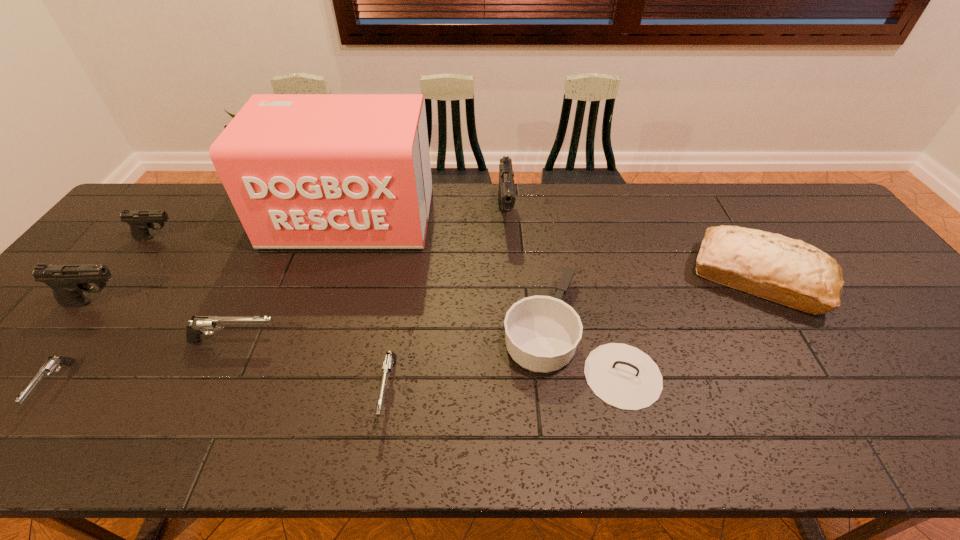
Locate an element on the screen. The width and height of the screenshot is (960, 540). vacant area that lies between the second silver pistol from right to left and the rightmost object is located at coordinates (497, 309).

This screenshot has height=540, width=960. In order to click on empty location between the rightmost object and the farthest silver pistol in this screenshot , I will do `click(497, 309)`.

Select which object is the third closest to the saucepan. Please provide its 2D coordinates. Your answer should be formatted as a tuple, i.e. [(x, y)], where the tuple contains the x and y coordinates of a point satisfying the conditions above.

[(303, 171)]

This screenshot has height=540, width=960. In order to click on object that is the seventh closest one to the saucepan in this screenshot , I will do `click(139, 221)`.

Find the location of `pistol that is the fifth closest one to the box`. pistol that is the fifth closest one to the box is located at coordinates (390, 359).

Find the location of `the fourth closest pistol to the saucepan`. the fourth closest pistol to the saucepan is located at coordinates (68, 282).

The image size is (960, 540). I want to click on the second closest black pistol relative to the shortest object, so click(139, 221).

Identify the location of black pistol that is the second closest to the rightmost silver pistol. The height and width of the screenshot is (540, 960). (68, 282).

This screenshot has height=540, width=960. Find the location of `silver pistol that stands as the closest to the shortest pistol`. silver pistol that stands as the closest to the shortest pistol is located at coordinates (199, 324).

Point out which silver pistol is positioned as the nearest to the rightmost black pistol. Please provide its 2D coordinates. Your answer should be formatted as a tuple, i.e. [(x, y)], where the tuple contains the x and y coordinates of a point satisfying the conditions above.

[(390, 359)]